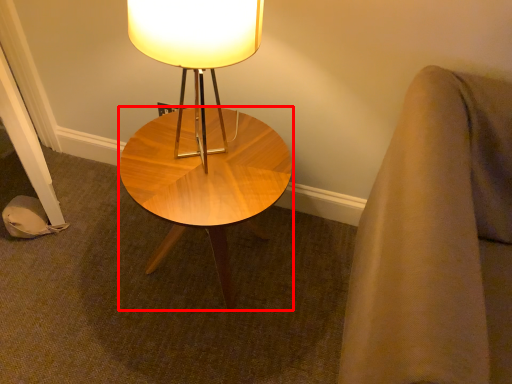
Question: Where is coffee table (annotated by the red box) located in relation to lamp in the image?

Choices:
 (A) right
 (B) left

Answer: (B)